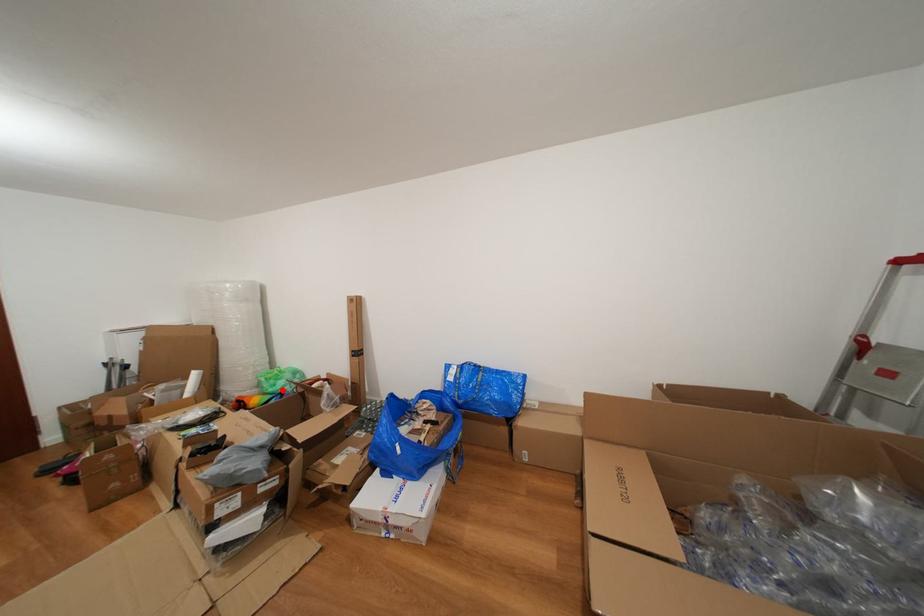
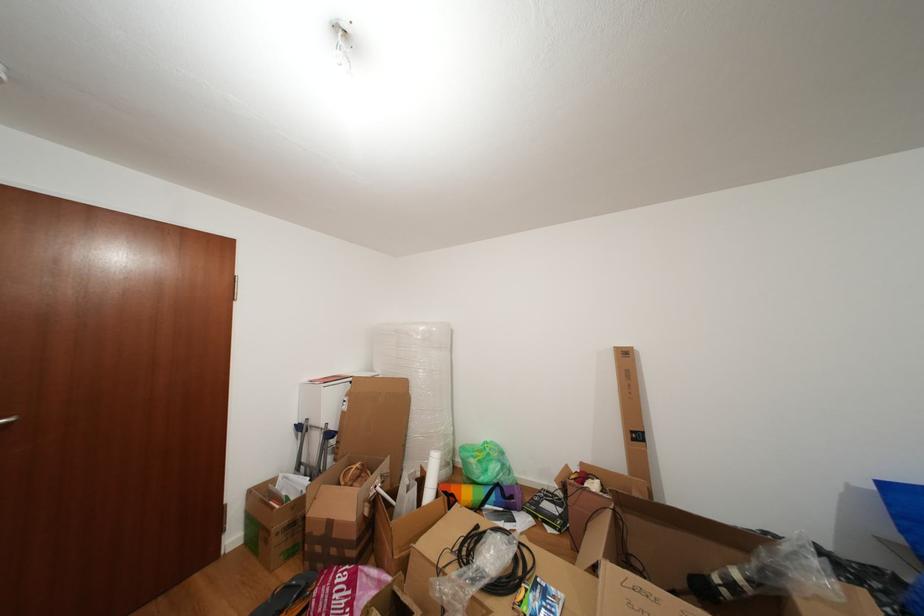
Where in the second image is the point corresponding to the highlighted location from the first image?

(494, 476)